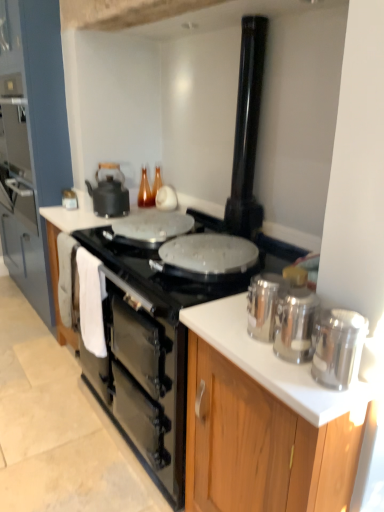
What is the approximate width of black matte oven at center?

2.87 meters.

What is the approximate width of black matte gas stove at center?

26.15 inches.

This screenshot has height=512, width=384. Find the location of `matte black kettle at upper left, marked as the 4th kitchen appliance in a front-to-back arrangement`. matte black kettle at upper left, marked as the 4th kitchen appliance in a front-to-back arrangement is located at coordinates (69, 199).

Where is `black matte oven at center`? black matte oven at center is located at coordinates (144, 387).

Looking at this image, from the image's perspective, which object appears higher, black glossy chimney at upper center or black matte oven at center?

black glossy chimney at upper center is shown above in the image.

Considering the sizes of black glossy chimney at upper center and black matte oven at center in the image, is black glossy chimney at upper center wider or thinner than black matte oven at center?

Considering their sizes, black glossy chimney at upper center looks slimmer than black matte oven at center.

Visually, is black glossy chimney at upper center positioned to the left or to the right of black matte oven at center?

From the image, it's evident that black glossy chimney at upper center is to the right of black matte oven at center.

In the image, is black glossy chimney at upper center positioned in front of or behind black matte oven at center?

black glossy chimney at upper center is positioned farther from the viewer than black matte oven at center.

Is silver metallic canisters at right, which appears as the first cabinetry when viewed from the front, wider or thinner than silver metallic canisters at right, which is the 2th kitchen appliance from top to bottom?

silver metallic canisters at right, which appears as the first cabinetry when viewed from the front, is wider than silver metallic canisters at right, which is the 2th kitchen appliance from top to bottom.

This screenshot has height=512, width=384. I want to click on the 3rd kitchen appliance to the left of the silver metallic canisters at right, which appears as the first cabinetry when viewed from the front, starting your count from the anchor, so click(263, 304).

Can you confirm if silver metallic canisters at right, placed as the second cabinetry when sorted from back to front, is shorter than silver metallic canisters at right, positioned as the 2th kitchen appliance in back-to-front order?

Incorrect, the height of silver metallic canisters at right, placed as the second cabinetry when sorted from back to front, does not fall short of that of silver metallic canisters at right, positioned as the 2th kitchen appliance in back-to-front order.

Would you say silver metallic canisters at right, placed as the second cabinetry when sorted from back to front, is a long distance from silver metallic canisters at right, which is the second kitchen appliance in left-to-right order?

No, silver metallic canisters at right, placed as the second cabinetry when sorted from back to front, is not far away from silver metallic canisters at right, which is the second kitchen appliance in left-to-right order.

Considering the relative positions of black matte oven at center and silver metallic canisters at right, placed as the third kitchen appliance when sorted from bottom to top, in the image provided, is black matte oven at center behind silver metallic canisters at right, placed as the third kitchen appliance when sorted from bottom to top,?

Yes.

Is point (140, 320) closer to camera compared to point (271, 314)?

No, (140, 320) is further to viewer.

Based on their positions, is black matte oven at center located to the left or right of silver metallic canisters at right, placed as the third kitchen appliance when sorted from front to back?

From the image, it's evident that black matte oven at center is to the left of silver metallic canisters at right, placed as the third kitchen appliance when sorted from front to back.

Looking at this image, from the image's perspective, is black matte oven at center on silver metallic canisters at right, placed as the third kitchen appliance when sorted from front to back?

Incorrect, from the image's perspective, black matte oven at center is lower than silver metallic canisters at right, placed as the third kitchen appliance when sorted from front to back.

Is the depth of silver metallic canisters at right, the 1th cabinetry when ordered from right to left, less than that of wooden cabinet at left, which appears as the 1th cabinetry when viewed from the back?

Yes, silver metallic canisters at right, the 1th cabinetry when ordered from right to left, is in front of wooden cabinet at left, which appears as the 1th cabinetry when viewed from the back.

Image resolution: width=384 pixels, height=512 pixels. Find the location of `cabinetry that appears behind the silver metallic canisters at right, placed as the second cabinetry when sorted from back to front`. cabinetry that appears behind the silver metallic canisters at right, placed as the second cabinetry when sorted from back to front is located at coordinates (57, 287).

Is there a large distance between silver metallic canisters at right, placed as the second cabinetry when sorted from back to front, and wooden cabinet at left, which appears as the 1th cabinetry when viewed from the left?

Indeed, silver metallic canisters at right, placed as the second cabinetry when sorted from back to front, is not near wooden cabinet at left, which appears as the 1th cabinetry when viewed from the left.

Which is further, [64,206] or [300,347]?

Positioned behind is point [64,206].

You are a GUI agent. You are given a task and a screenshot of the screen. Output one action in this format:
    pyautogui.click(x=<x>, y=<y>)
    Task: Click on the 2nd kitchen appliance in front when counting from the matte black kettle at upper left, acting as the first kitchen appliance starting from the top
    Image resolution: width=384 pixels, height=512 pixels.
    Given the screenshot: What is the action you would take?
    pyautogui.click(x=295, y=324)

Considering the relative positions of matte black kettle at upper left, acting as the first kitchen appliance starting from the top, and polished stainless steel canisters at right, marked as the 2th kitchen appliance in a right-to-left arrangement, in the image provided, is matte black kettle at upper left, acting as the first kitchen appliance starting from the top, in front of polished stainless steel canisters at right, marked as the 2th kitchen appliance in a right-to-left arrangement,?

No, it is not.

Is matte black kettle at upper left, marked as the 4th kitchen appliance in a front-to-back arrangement, taller than polished stainless steel canisters at right, positioned as the third kitchen appliance in left-to-right order?

Incorrect, the height of matte black kettle at upper left, marked as the 4th kitchen appliance in a front-to-back arrangement, is not larger of that of polished stainless steel canisters at right, positioned as the third kitchen appliance in left-to-right order.

From the image's perspective, which kitchen appliance is the 3rd one below the matte black kettle at upper left, which is counted as the 4th kitchen appliance, starting from the right? Please provide its 2D coordinates.

[(338, 347)]

Can you see matte black kettle at upper left, which is counted as the 4th kitchen appliance, starting from the right, touching polished stainless steel canisters at right, the first kitchen appliance positioned from the right?

matte black kettle at upper left, which is counted as the 4th kitchen appliance, starting from the right, and polished stainless steel canisters at right, the first kitchen appliance positioned from the right, are clearly separated.

Is matte black kettle at upper left, marked as the 4th kitchen appliance in a front-to-back arrangement, at the right side of polished stainless steel canisters at right, the first kitchen appliance positioned from the right?

No.

Considering the sizes of objects white glossy countertop at center and wooden cabinet at left, which appears as the 1th cabinetry when viewed from the back, in the image provided, who is thinner, white glossy countertop at center or wooden cabinet at left, which appears as the 1th cabinetry when viewed from the back,?

Thinner between the two is wooden cabinet at left, which appears as the 1th cabinetry when viewed from the back.

Considering the relative positions of white glossy countertop at center and wooden cabinet at left, which appears as the 1th cabinetry when viewed from the back, in the image provided, is white glossy countertop at center behind wooden cabinet at left, which appears as the 1th cabinetry when viewed from the back,?

No, it is not.

Does point (326, 431) come in front of point (62, 326)?

Yes, it is in front of point (62, 326).

Locate an element on the screen. This screenshot has width=384, height=512. counter top located below the wooden cabinet at left, which appears as the 1th cabinetry when viewed from the left (from the image's perspective) is located at coordinates (367, 426).

You are a GUI agent. You are given a task and a screenshot of the screen. Output one action in this format:
    pyautogui.click(x=<x>, y=<y>)
    Task: Click on the appliance behind the black matte oven at center
    
    Given the screenshot: What is the action you would take?
    pyautogui.click(x=247, y=131)

This screenshot has width=384, height=512. There is a silver metallic canisters at right, positioned as the third kitchen appliance in right-to-left order. In order to click on the 2nd cabinetry below it (from the image's perspective) in this screenshot , I will do `click(268, 423)`.

Looking at the image, which one is located further to silver metallic canisters at right, placed as the third kitchen appliance when sorted from front to back, polished stainless steel canisters at right, the 4th kitchen appliance when ordered from back to front, or silver metallic canisters at right, the second cabinetry in the left-to-right sequence?

Among the two, silver metallic canisters at right, the second cabinetry in the left-to-right sequence, is located further to silver metallic canisters at right, placed as the third kitchen appliance when sorted from front to back.

From the picture: Which object lies nearer to the anchor point matte black kettle at upper left, which is the fourth kitchen appliance from bottom to top, silver metallic canisters at right, which appears as the first cabinetry when viewed from the front, or white glossy countertop at center?

Based on the image, white glossy countertop at center appears to be nearer to matte black kettle at upper left, which is the fourth kitchen appliance from bottom to top.

Looking at the image, which one is located closer to silver metallic canisters at right, which appears as the first cabinetry when viewed from the front, black matte oven at center or white glossy countertop at center?

The object closer to silver metallic canisters at right, which appears as the first cabinetry when viewed from the front, is white glossy countertop at center.

Looking at the image, which one is located closer to polished stainless steel canisters at right, acting as the 3th kitchen appliance starting from the top, black matte oven at center or white glossy countertop at center?

white glossy countertop at center lies closer to polished stainless steel canisters at right, acting as the 3th kitchen appliance starting from the top, than the other object.

Based on their spatial positions, is black matte gas stove at center or black matte oven at center further from wooden cabinet at left, the 2th cabinetry positioned from the right?

The object further to wooden cabinet at left, the 2th cabinetry positioned from the right, is black matte gas stove at center.

Which object lies further to the anchor point matte black kettle at upper left, which ranks as the first kitchen appliance in back-to-front order, black matte oven at center or wooden cabinet at left, which is the 2th cabinetry from front to back?

Among the two, black matte oven at center is located further to matte black kettle at upper left, which ranks as the first kitchen appliance in back-to-front order.

Based on their spatial positions, is silver metallic canisters at right, which appears as the first cabinetry when viewed from the front, or polished stainless steel canisters at right, marked as the 2th kitchen appliance in a right-to-left arrangement, closer to matte black kettle at upper left, the first kitchen appliance in the left-to-right sequence?

The object closer to matte black kettle at upper left, the first kitchen appliance in the left-to-right sequence, is silver metallic canisters at right, which appears as the first cabinetry when viewed from the front.

Estimate the real-world distances between objects in this image. Which object is closer to white glossy countertop at center, matte black kettle at upper left, which ranks as the first kitchen appliance in back-to-front order, or silver metallic canisters at right, positioned as the 2th kitchen appliance in back-to-front order?

The object closer to white glossy countertop at center is silver metallic canisters at right, positioned as the 2th kitchen appliance in back-to-front order.

Locate an element on the screen. appliance between black matte gas stove at center and matte black kettle at upper left, acting as the first kitchen appliance starting from the top, along the z-axis is located at coordinates (247, 131).

Find the location of a particular element. Image resolution: width=384 pixels, height=512 pixels. appliance between polished stainless steel canisters at right, the third kitchen appliance in the back-to-front sequence, and matte black kettle at upper left, which is the fourth kitchen appliance from bottom to top, from front to back is located at coordinates (247, 131).

Find the location of a particular element. Image resolution: width=384 pixels, height=512 pixels. cabinetry between polished stainless steel canisters at right, positioned as the third kitchen appliance in left-to-right order, and matte black kettle at upper left, acting as the first kitchen appliance starting from the top, along the z-axis is located at coordinates (57, 287).

Where is `appliance between polished stainless steel canisters at right, the first kitchen appliance in the bottom-to-top sequence, and matte black kettle at upper left, marked as the 4th kitchen appliance in a front-to-back arrangement, along the z-axis`? The width and height of the screenshot is (384, 512). appliance between polished stainless steel canisters at right, the first kitchen appliance in the bottom-to-top sequence, and matte black kettle at upper left, marked as the 4th kitchen appliance in a front-to-back arrangement, along the z-axis is located at coordinates (247, 131).